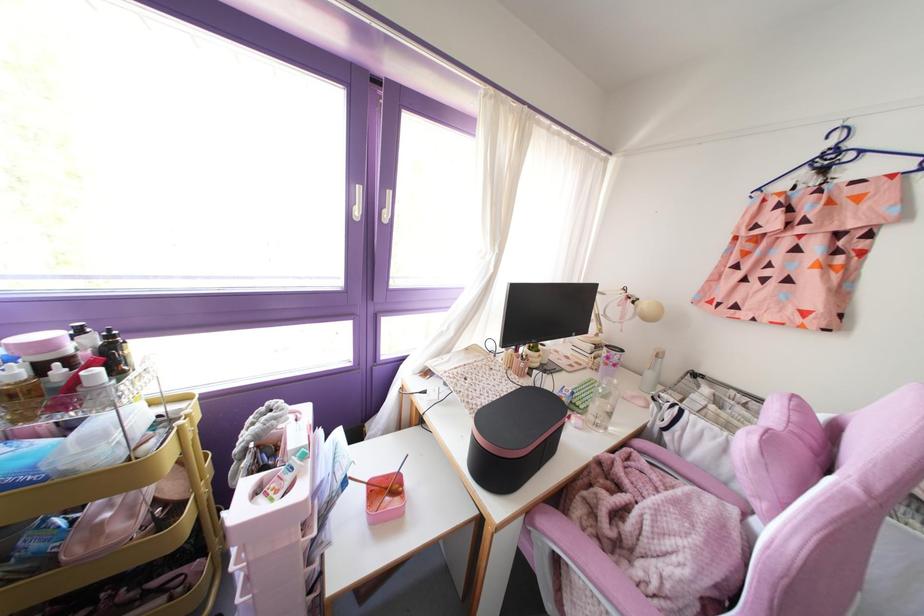
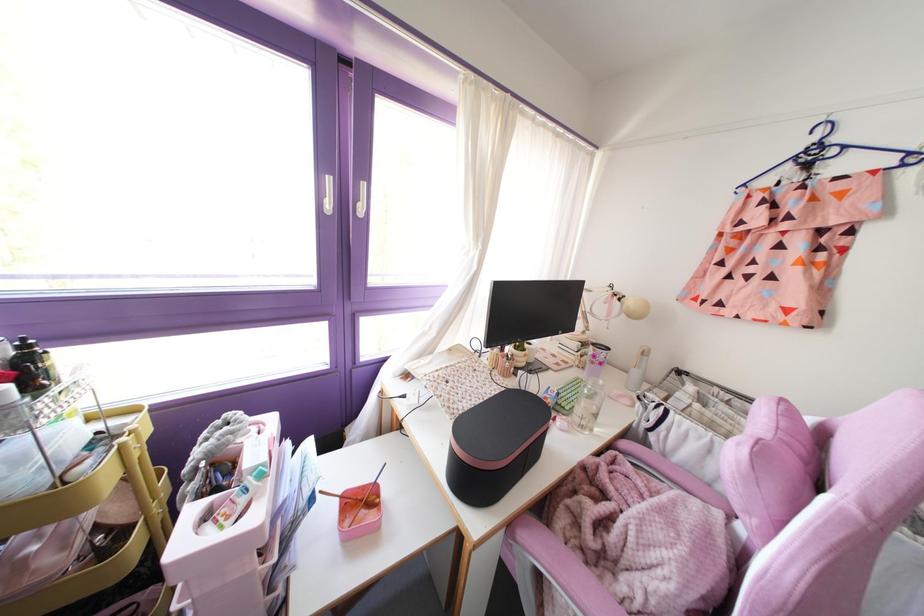
Locate, in the second image, the point that corresponds to (x=626, y=541) in the first image.

(610, 553)